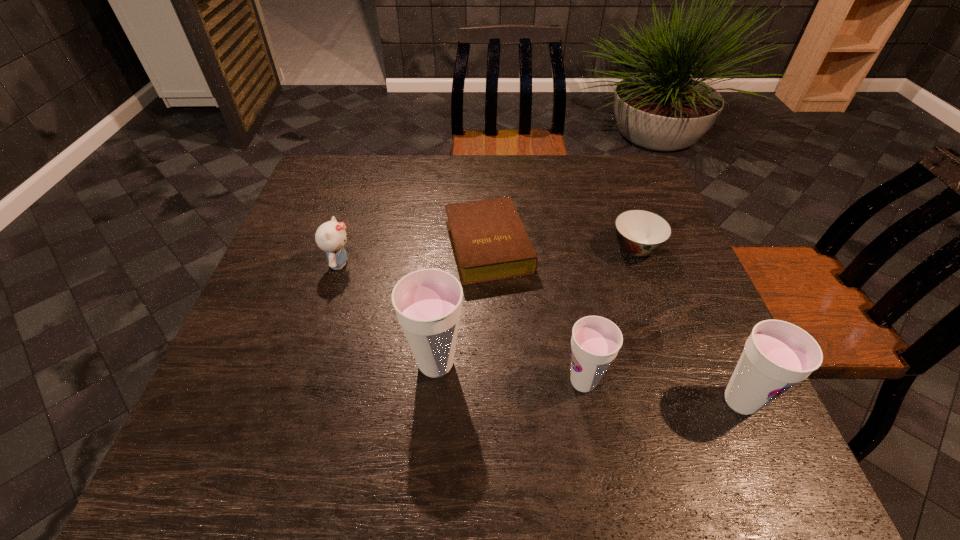
Please point a free position for a cup on the left. Please provide its 2D coordinates. Your answer should be formatted as a tuple, i.e. [(x, y)], where the tuple contains the x and y coordinates of a point satisfying the conditions above.

[(298, 347)]